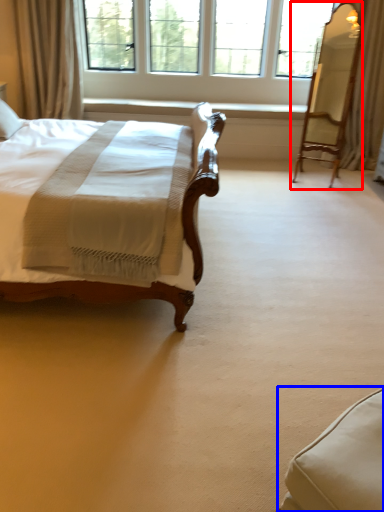
Question: Among these objects, which one is nearest to the camera, swivel chair (highlighted by a red box) or swivel chair (highlighted by a blue box)?

Choices:
 (A) swivel chair
 (B) swivel chair

Answer: (B)